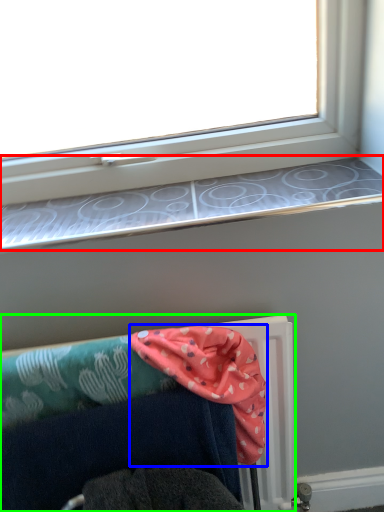
Question: Which is nearer to the window sill (highlighted by a red box)? scarf (highlighted by a blue box) or furniture (highlighted by a green box).

Choices:
 (A) scarf
 (B) furniture

Answer: (A)